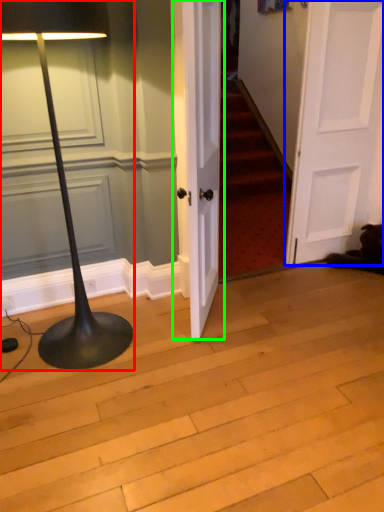
Question: Considering the real-world distances, which object is farthest from lamp (highlighted by a red box)? door (highlighted by a blue box) or door (highlighted by a green box)?

Choices:
 (A) door
 (B) door

Answer: (A)